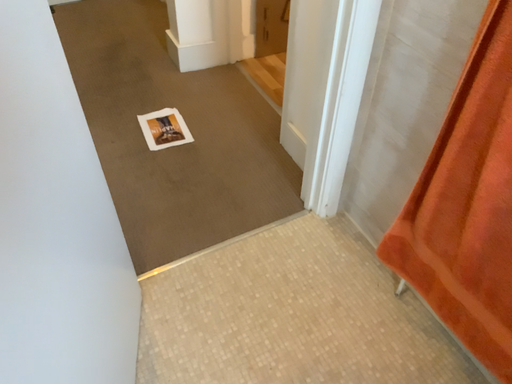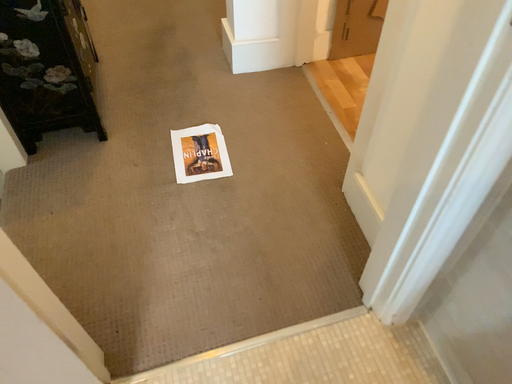
Question: Which way did the camera rotate in the video?

Choices:
 (A) rotated right
 (B) rotated left

Answer: (B)